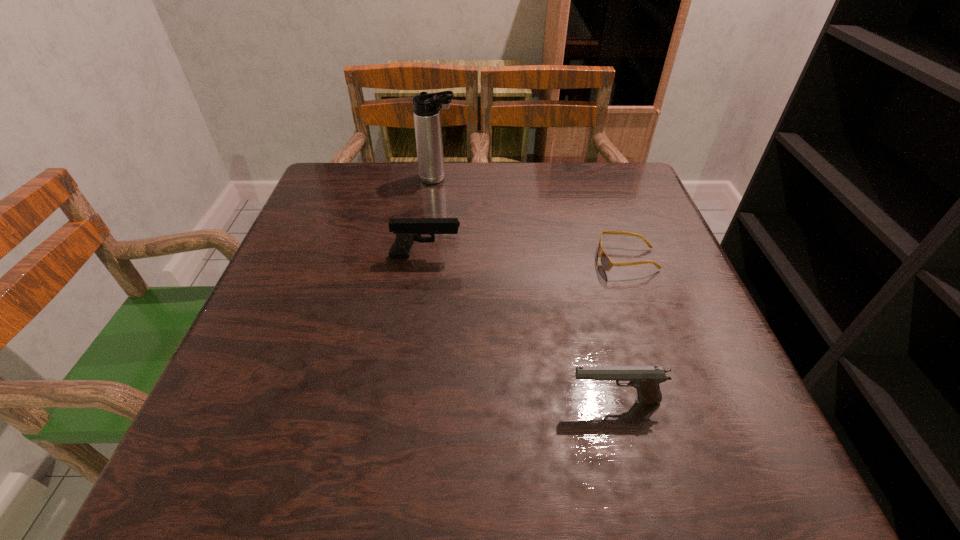
The image size is (960, 540). I want to click on free region located 0.330m at the barrel of the right pistol, so click(361, 401).

Image resolution: width=960 pixels, height=540 pixels. I want to click on vacant region located 0.230m on the front-facing side of the shortest object, so click(491, 260).

The width and height of the screenshot is (960, 540). Find the location of `free region located 0.350m on the front-facing side of the shortest object`. free region located 0.350m on the front-facing side of the shortest object is located at coordinates (434, 260).

Where is `vacant area situated 0.240m on the front-facing side of the shortest object`? Image resolution: width=960 pixels, height=540 pixels. vacant area situated 0.240m on the front-facing side of the shortest object is located at coordinates (486, 260).

The image size is (960, 540). In order to click on object that is at the far edge in this screenshot , I will do [x=426, y=111].

What are the coordinates of `pistol located in the right edge section of the desktop` in the screenshot? It's located at (646, 379).

This screenshot has height=540, width=960. I want to click on sunglasses present at the right edge, so click(606, 263).

Locate an element on the screen. The width and height of the screenshot is (960, 540). free region at the far edge of the desktop is located at coordinates (377, 199).

At what (x,y) coordinates should I click in order to perform the action: click on vacant space at the near edge of the desktop. Please return your answer as a coordinate pair (x, y). This screenshot has width=960, height=540. Looking at the image, I should click on (534, 489).

Where is `blank space at the left edge of the desktop`? The image size is (960, 540). blank space at the left edge of the desktop is located at coordinates (329, 245).